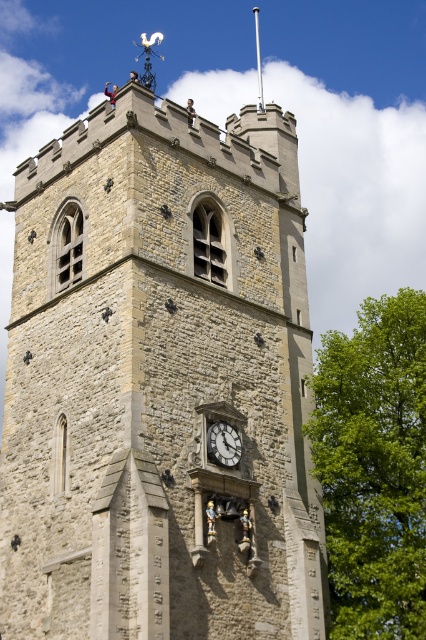
Question: Among these points, which one is farthest from the camera?

Choices:
 (A) (354, 378)
 (B) (209, 225)

Answer: (B)

Question: Is stone clock tower at center thinner than green leafy tree at right?

Choices:
 (A) yes
 (B) no

Answer: (A)

Question: Does stone clock tower at center appear on the right side of green leafy tree at right?

Choices:
 (A) no
 (B) yes

Answer: (A)

Question: Which object is farther from the camera taking this photo?

Choices:
 (A) stone clock tower at center
 (B) green leafy tree at right

Answer: (B)

Question: Which object appears farthest from the camera in this image?

Choices:
 (A) stone clock tower at center
 (B) green leafy tree at right
 (C) white stone clock at center

Answer: (B)

Question: Does stone clock tower at center have a greater width compared to green leafy tree at right?

Choices:
 (A) no
 (B) yes

Answer: (A)